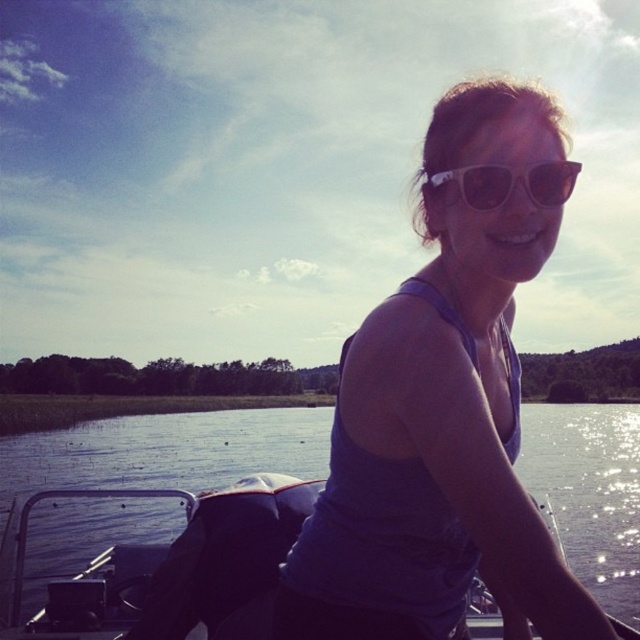
Question: Considering the relative positions of transparent water at center and white plastic sunglasses at center in the image provided, where is transparent water at center located with respect to white plastic sunglasses at center?

Choices:
 (A) left
 (B) right

Answer: (B)

Question: Is purple fabric tank top at center above transparent water at center?

Choices:
 (A) yes
 (B) no

Answer: (A)

Question: Is purple fabric tank top at center to the right of white plastic sunglasses at center from the viewer's perspective?

Choices:
 (A) yes
 (B) no

Answer: (B)

Question: Estimate the real-world distances between objects in this image. Which object is closer to the transparent water at center?

Choices:
 (A) purple fabric tank top at center
 (B) white plastic sunglasses at center

Answer: (A)

Question: Considering the real-world distances, which object is farthest from the purple fabric tank top at center?

Choices:
 (A) transparent water at center
 (B) white plastic sunglasses at center

Answer: (A)

Question: Which object appears farthest from the camera in this image?

Choices:
 (A) transparent water at center
 (B) purple fabric tank top at center

Answer: (A)